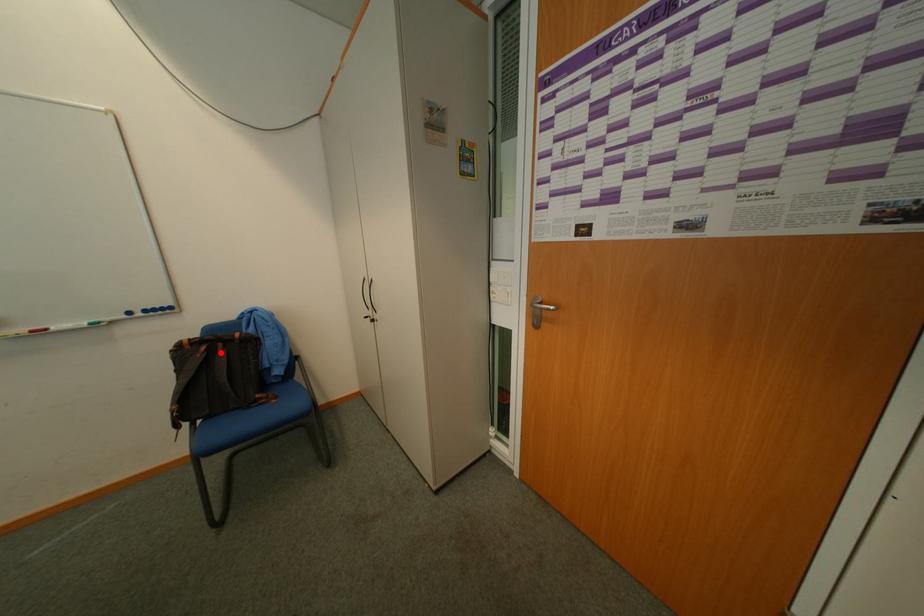
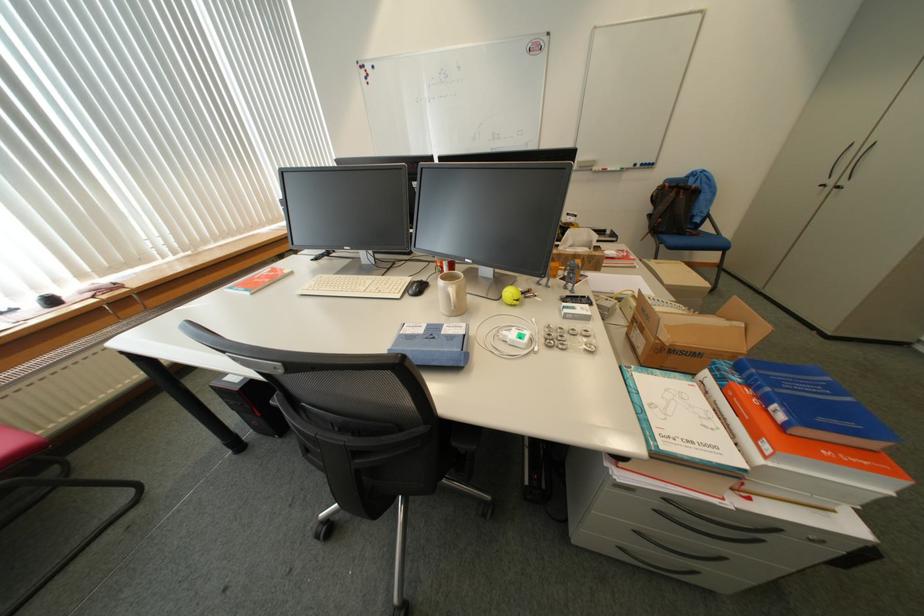
Question: I am providing you with two images of the same scene from different viewpoints. In image1, a red point is highlighted. Considering the same 3D point in image2, which of the following is correct?

Choices:
 (A) It is closer
 (B) It is farther

Answer: (A)